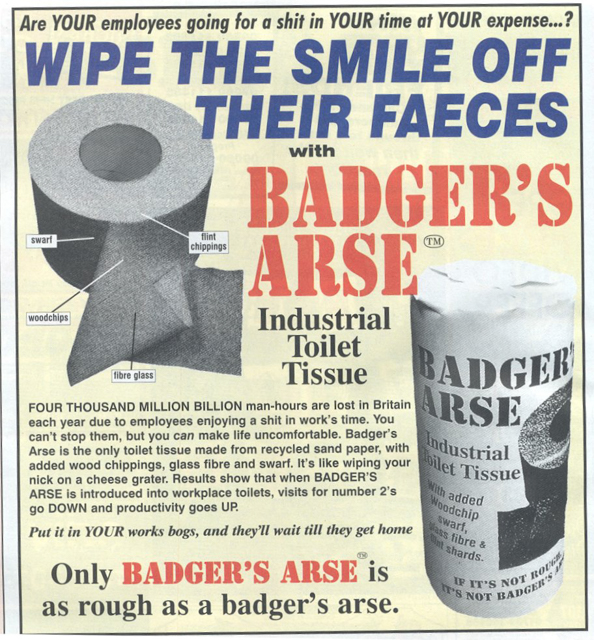
Where is `cream colored background`? The image size is (594, 640). cream colored background is located at coordinates (267, 381).